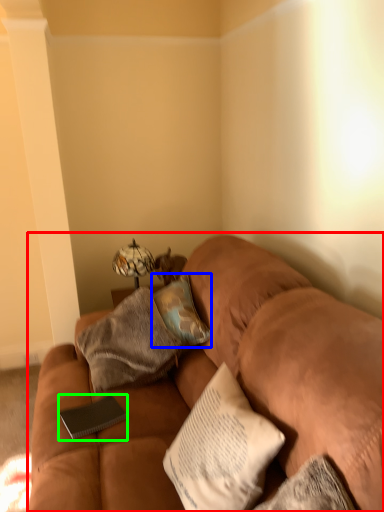
Question: Which object is positioned closest to studio couch (highlighted by a red box)? Select from pillow (highlighted by a blue box) and pad (highlighted by a green box).

Choices:
 (A) pillow
 (B) pad

Answer: (A)